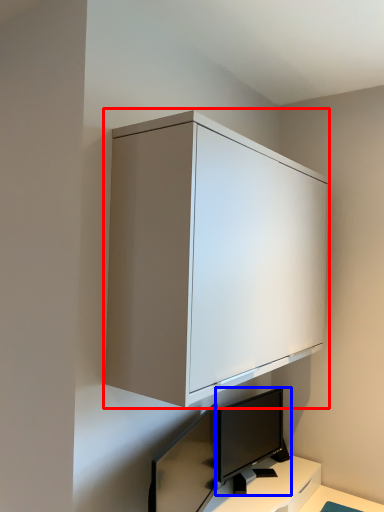
Question: Among these objects, which one is nearest to the camera, cabinetry (highlighted by a red box) or computer monitor (highlighted by a blue box)?

Choices:
 (A) cabinetry
 (B) computer monitor

Answer: (A)